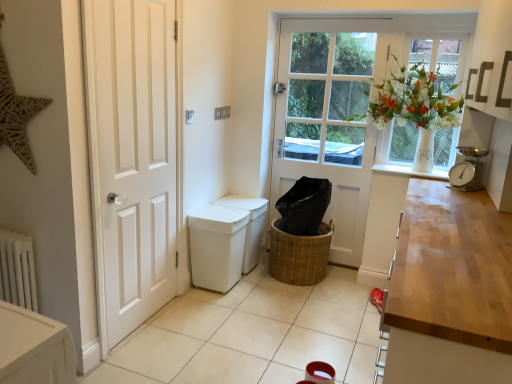
The width and height of the screenshot is (512, 384). I want to click on blank space above white wooden door at center, marked as the second door in a left-to-right arrangement (from a real-world perspective), so click(x=333, y=23).